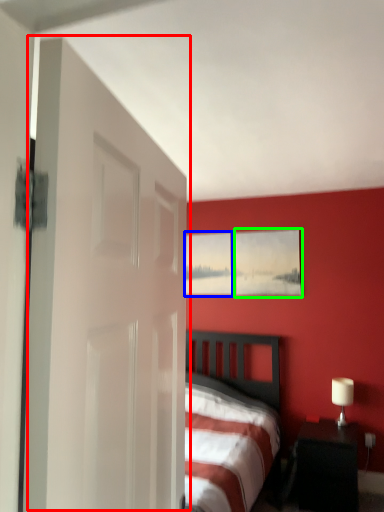
Question: Which is nearer to the door (highlighted by a red box)? picture frame (highlighted by a blue box) or picture frame (highlighted by a green box).

Choices:
 (A) picture frame
 (B) picture frame

Answer: (B)